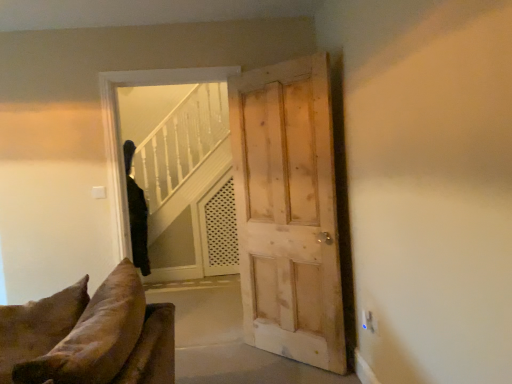
What do you see at coordinates (136, 214) in the screenshot?
I see `black fabric coat at upper left` at bounding box center [136, 214].

Locate an element on the screen. light brown wooden door at center is located at coordinates (288, 211).

Find the location of `black fabric coat at upper left`. black fabric coat at upper left is located at coordinates (136, 214).

Considering the positions of points (142, 267) and (122, 211), is point (142, 267) closer to camera compared to point (122, 211)?

No, it is behind (122, 211).

Does black fabric coat at upper left have a lesser height compared to transparent glass door at center?

Yes.

From the picture: Does black fabric coat at upper left have a lesser width compared to transparent glass door at center?

No, black fabric coat at upper left is not thinner than transparent glass door at center.

Identify the location of person located on the left of transparent glass door at center. (136, 214).

From a real-world perspective, which is physically above, transparent glass door at center or black fabric coat at upper left?

transparent glass door at center is physically above.

Is black fabric coat at upper left at the back of transparent glass door at center?

Yes, transparent glass door at center is facing away from black fabric coat at upper left.

Is transparent glass door at center next to black fabric coat at upper left?

No, transparent glass door at center is not beside black fabric coat at upper left.

Is light brown wooden door at center oriented away from black fabric coat at upper left?

light brown wooden door at center is not turned away from black fabric coat at upper left.

Is light brown wooden door at center bigger than black fabric coat at upper left?

No, light brown wooden door at center is not bigger than black fabric coat at upper left.

From the image's perspective, is light brown wooden door at center located above or below black fabric coat at upper left?

Based on their image positions, light brown wooden door at center is located above black fabric coat at upper left.

Considering the sizes of black fabric coat at upper left and light brown wooden door at center in the image, is black fabric coat at upper left wider or thinner than light brown wooden door at center?

In the image, black fabric coat at upper left appears to be wider than light brown wooden door at center.

From a real-world perspective, between black fabric coat at upper left and light brown wooden door at center, who is vertically lower?

black fabric coat at upper left.

Considering the relative positions of black fabric coat at upper left and light brown wooden door at center in the image provided, is black fabric coat at upper left to the left of light brown wooden door at center from the viewer's perspective?

Indeed, black fabric coat at upper left is positioned on the left side of light brown wooden door at center.

Is there a large distance between black fabric coat at upper left and light brown wooden door at center?

Yes, black fabric coat at upper left and light brown wooden door at center are located far from each other.

Could you tell me if transparent glass door at center is turned towards light brown wooden door at center?

No, transparent glass door at center is not turned towards light brown wooden door at center.

In the image, is transparent glass door at center on the left side or the right side of light brown wooden door at center?

Clearly, transparent glass door at center is on the left of light brown wooden door at center in the image.

From the picture: Which is behind, transparent glass door at center or light brown wooden door at center?

transparent glass door at center is more distant.

Locate an element on the screen. The image size is (512, 384). door below the transparent glass door at center (from the image's perspective) is located at coordinates (288, 211).

Is light brown wooden door at center in front of or behind transparent glass door at center in the image?

In the image, light brown wooden door at center appears in front of transparent glass door at center.

Considering the sizes of objects light brown wooden door at center and transparent glass door at center in the image provided, who is smaller, light brown wooden door at center or transparent glass door at center?

With smaller size is light brown wooden door at center.

How distant is light brown wooden door at center from transparent glass door at center?

light brown wooden door at center is 85.38 centimeters away from transparent glass door at center.

Considering the relative positions of light brown wooden door at center and transparent glass door at center in the image provided, is light brown wooden door at center to the left of transparent glass door at center from the viewer's perspective?

No, light brown wooden door at center is not to the left of transparent glass door at center.

The height and width of the screenshot is (384, 512). In order to click on person below the transparent glass door at center (from the image's perspective) in this screenshot , I will do `click(136, 214)`.

The image size is (512, 384). What are the coordinates of `window in front of the black fabric coat at upper left` in the screenshot? It's located at (119, 128).

Looking at the image, which one is located further to light brown wooden door at center, transparent glass door at center or black fabric coat at upper left?

black fabric coat at upper left is further to light brown wooden door at center.

When comparing their distances from black fabric coat at upper left, does transparent glass door at center or light brown wooden door at center seem further?

light brown wooden door at center is further to black fabric coat at upper left.

Which object lies further to the anchor point black fabric coat at upper left, light brown wooden door at center or transparent glass door at center?

light brown wooden door at center lies further to black fabric coat at upper left than the other object.

Estimate the real-world distances between objects in this image. Which object is further from transparent glass door at center, light brown wooden door at center or black fabric coat at upper left?

black fabric coat at upper left is positioned further to the anchor transparent glass door at center.

Which object lies further to the anchor point light brown wooden door at center, black fabric coat at upper left or transparent glass door at center?

black fabric coat at upper left lies further to light brown wooden door at center than the other object.

Which object lies nearer to the anchor point transparent glass door at center, black fabric coat at upper left or light brown wooden door at center?

light brown wooden door at center lies closer to transparent glass door at center than the other object.

Where is `window located between light brown wooden door at center and black fabric coat at upper left in the depth direction`? This screenshot has height=384, width=512. window located between light brown wooden door at center and black fabric coat at upper left in the depth direction is located at coordinates (119, 128).